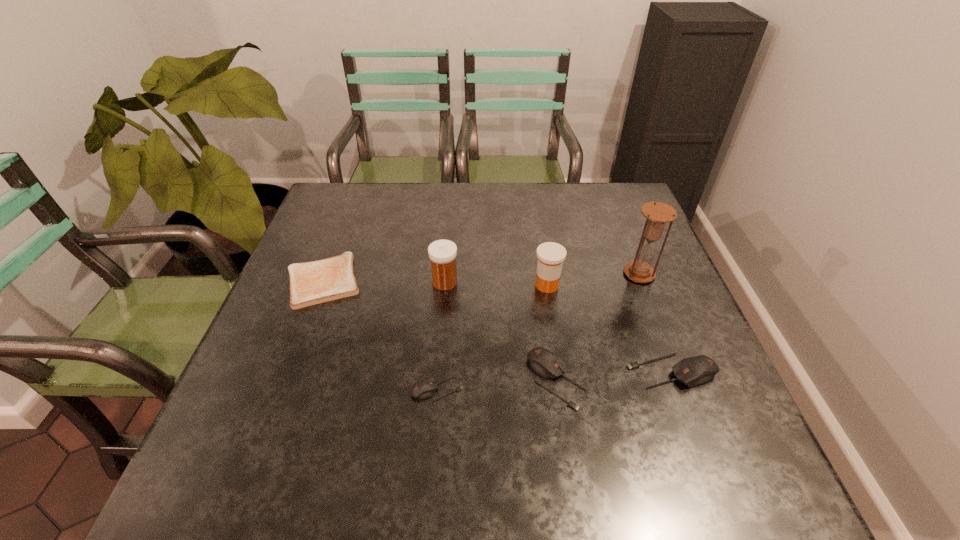
Where is `empty location between the tallest object and the toast`? This screenshot has width=960, height=540. empty location between the tallest object and the toast is located at coordinates (481, 277).

Locate an element on the screen. Image resolution: width=960 pixels, height=540 pixels. free area in between the second shortest mouse and the right medicine is located at coordinates (552, 333).

Find the location of a particular element. The image size is (960, 540). empty location between the second tallest mouse and the right medicine is located at coordinates (552, 333).

Where is `vacant point located between the shortest object and the tallest object`? vacant point located between the shortest object and the tallest object is located at coordinates (481, 277).

At what (x,y) coordinates should I click in order to perform the action: click on vacant space that is in between the rightmost mouse and the second shortest mouse. Please return your answer as a coordinate pair (x, y). The width and height of the screenshot is (960, 540). Looking at the image, I should click on (614, 375).

The image size is (960, 540). Find the location of `vacant region between the second shortest mouse and the rightmost mouse`. vacant region between the second shortest mouse and the rightmost mouse is located at coordinates (614, 375).

What are the coordinates of `object that is the second closest one to the shortest object` in the screenshot? It's located at (425, 388).

Identify the location of the second closest object to the right medicine. Image resolution: width=960 pixels, height=540 pixels. (547, 364).

Select which mouse is the third closest to the right medicine. Please provide its 2D coordinates. Your answer should be formatted as a tuple, i.e. [(x, y)], where the tuple contains the x and y coordinates of a point satisfying the conditions above.

[(425, 388)]

This screenshot has height=540, width=960. I want to click on mouse that is the second closest to the second shortest mouse, so click(425, 388).